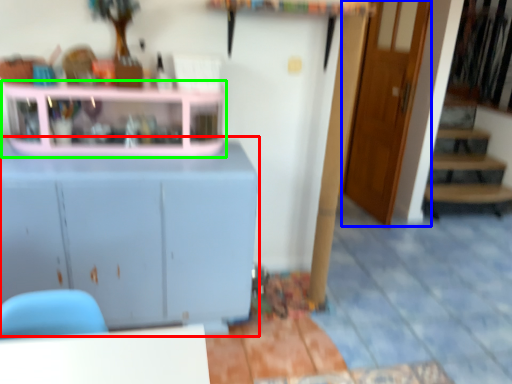
Question: Estimate the real-world distances between objects in this image. Which object is closer to cabinetry (highlighted by a red box), door (highlighted by a blue box) or shelf (highlighted by a green box)?

Choices:
 (A) door
 (B) shelf

Answer: (B)